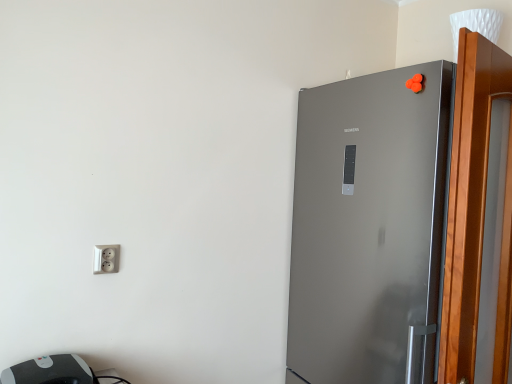
Question: Could you tell me if satin silver refrigerator at right is facing wooden screen door at right?

Choices:
 (A) yes
 (B) no

Answer: (B)

Question: Does satin silver refrigerator at right have a greater width compared to wooden screen door at right?

Choices:
 (A) no
 (B) yes

Answer: (B)

Question: Is the position of satin silver refrigerator at right more distant than that of wooden screen door at right?

Choices:
 (A) yes
 (B) no

Answer: (A)

Question: Is satin silver refrigerator at right positioned far away from wooden screen door at right?

Choices:
 (A) yes
 (B) no

Answer: (B)

Question: Is satin silver refrigerator at right shorter than wooden screen door at right?

Choices:
 (A) no
 (B) yes

Answer: (A)

Question: Looking at their shapes, would you say gray plastic printer at lower left is wider or thinner than satin silver refrigerator at right?

Choices:
 (A) thin
 (B) wide

Answer: (A)

Question: Based on their positions, is gray plastic printer at lower left located to the left or right of satin silver refrigerator at right?

Choices:
 (A) right
 (B) left

Answer: (B)

Question: From the image's perspective, relative to satin silver refrigerator at right, is gray plastic printer at lower left above or below?

Choices:
 (A) below
 (B) above

Answer: (A)

Question: Is gray plastic printer at lower left bigger or smaller than satin silver refrigerator at right?

Choices:
 (A) small
 (B) big

Answer: (A)

Question: In terms of width, does wooden screen door at right look wider or thinner when compared to satin silver refrigerator at right?

Choices:
 (A) thin
 (B) wide

Answer: (A)

Question: Does point tap(504, 281) appear closer or farther from the camera than point tap(435, 148)?

Choices:
 (A) closer
 (B) farther

Answer: (A)

Question: Is wooden screen door at right in front of or behind satin silver refrigerator at right in the image?

Choices:
 (A) behind
 (B) front

Answer: (B)

Question: From a real-world perspective, relative to satin silver refrigerator at right, is wooden screen door at right vertically above or below?

Choices:
 (A) above
 (B) below

Answer: (A)

Question: Is point (31, 362) positioned closer to the camera than point (500, 360)?

Choices:
 (A) farther
 (B) closer

Answer: (B)

Question: From a real-world perspective, relative to wooden screen door at right, is gray plastic printer at lower left vertically above or below?

Choices:
 (A) below
 (B) above

Answer: (A)